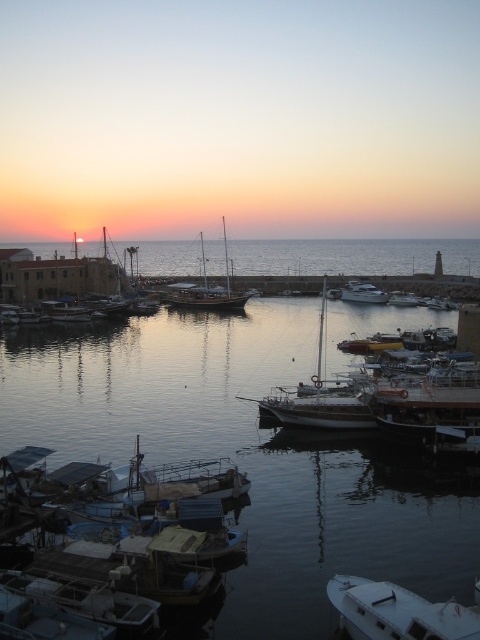
You are standing at the center of the harbor and want to reach the blue plastic boat at lower left. Which direction should you head towards?

The blue plastic boat at lower left is located at point (x=131, y=572) in 2D coordinates. Since you are at the center, you should head towards the lower left direction to reach it.

You are standing at the edge of the harbor looking out at the boats. There are two points marked in the scene, one at coordinates point (x=219, y=538) and another at point (x=399, y=596). Which of these points is closer to you?

Point (x=219, y=538) is closer to you because it is further to the viewer than point (x=399, y=596).